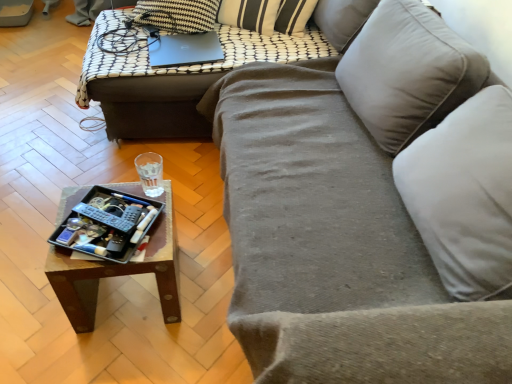
Where is `free space above metallic tray at lower left (from a real-world perspective)`? This screenshot has height=384, width=512. free space above metallic tray at lower left (from a real-world perspective) is located at coordinates (109, 223).